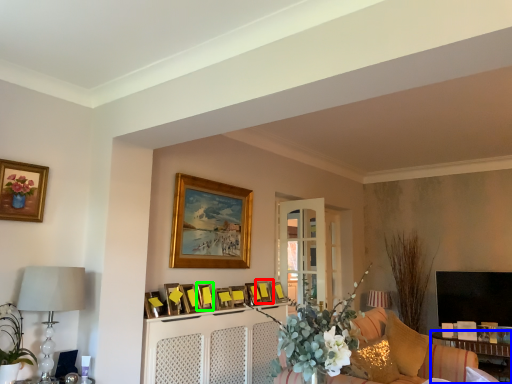
Question: Which is nearer to the picture frame (highlighted by a red box)? table (highlighted by a blue box) or picture frame (highlighted by a green box).

Choices:
 (A) table
 (B) picture frame

Answer: (B)